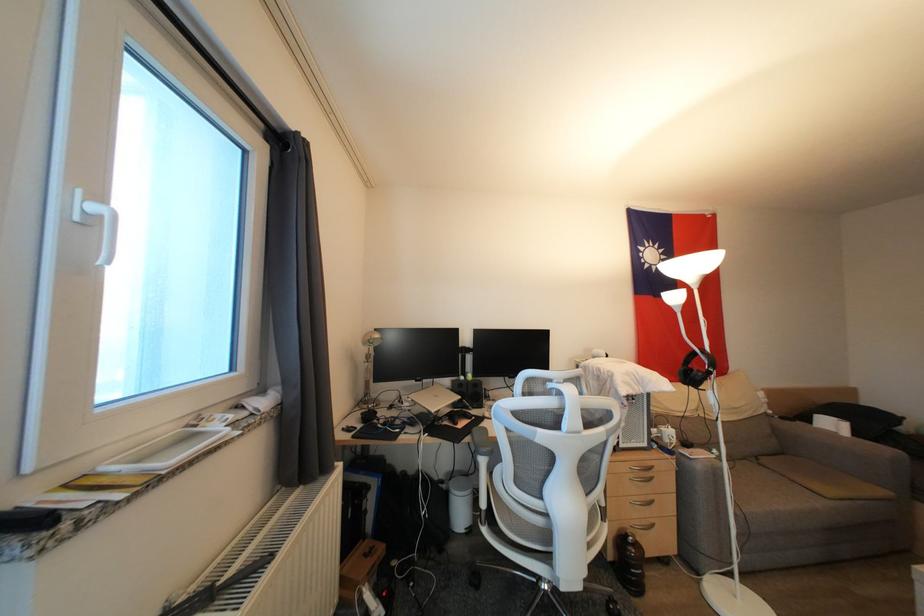
Find the location of `sofa sitting surface`. sofa sitting surface is located at coordinates (821, 479).